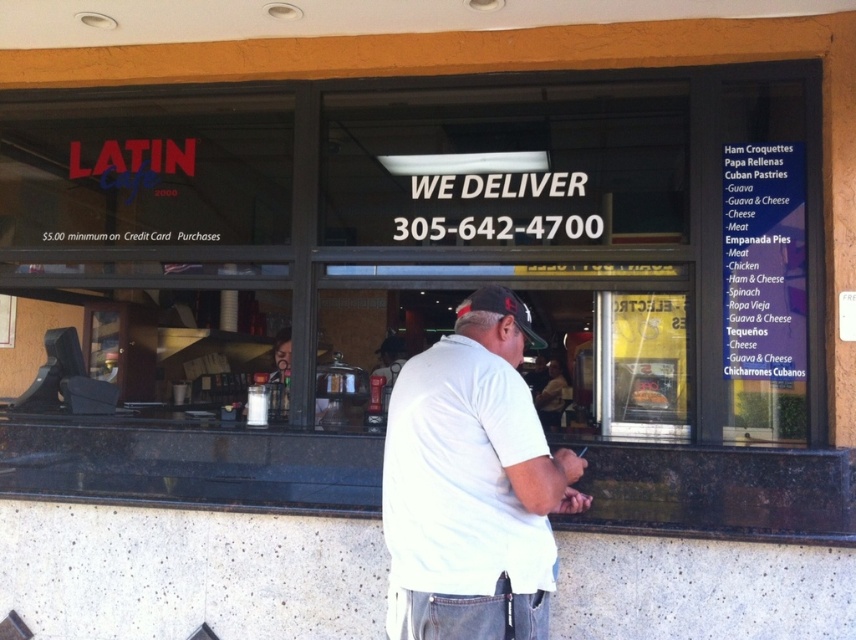
Question: Which point is farther to the camera?

Choices:
 (A) black fabric baseball cap at center
 (B) white cotton shirt at center

Answer: (A)

Question: Which point appears closest to the camera in this image?

Choices:
 (A) [482, 477]
 (B) [509, 300]

Answer: (A)

Question: Can you confirm if white cotton shirt at center is wider than black fabric baseball cap at center?

Choices:
 (A) no
 (B) yes

Answer: (B)

Question: Which point is farther from the camera taking this photo?

Choices:
 (A) (522, 301)
 (B) (526, 508)

Answer: (A)

Question: Can you confirm if white cotton shirt at center is positioned above black fabric baseball cap at center?

Choices:
 (A) no
 (B) yes

Answer: (A)

Question: Can you confirm if white cotton shirt at center is positioned above black fabric baseball cap at center?

Choices:
 (A) no
 (B) yes

Answer: (A)